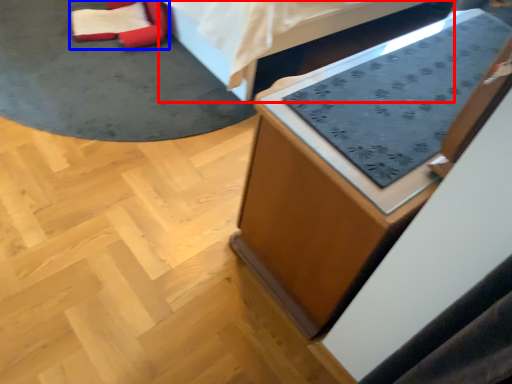
Question: Which object is further to the camera taking this photo, furniture (highlighted by a red box) or bean bag chair (highlighted by a blue box)?

Choices:
 (A) furniture
 (B) bean bag chair

Answer: (B)